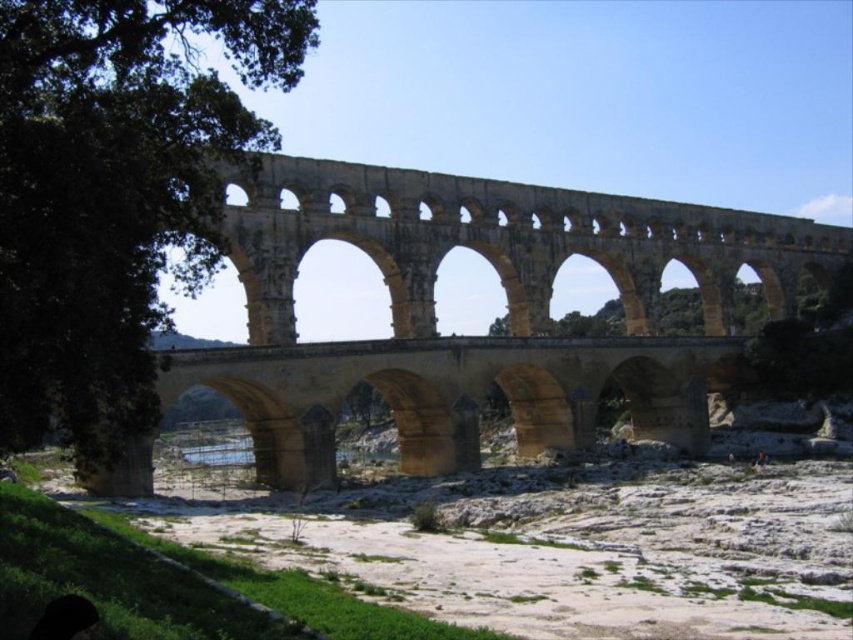
Question: Does yellow stone bridge at center appear on the right side of green leafy tree at left?

Choices:
 (A) no
 (B) yes

Answer: (B)

Question: Which object appears farthest from the camera in this image?

Choices:
 (A) green leafy tree at left
 (B) yellow stone bridge at center

Answer: (B)

Question: Can you confirm if yellow stone bridge at center is positioned above green leafy tree at left?

Choices:
 (A) yes
 (B) no

Answer: (B)

Question: Considering the relative positions of yellow stone bridge at center and green leafy tree at left in the image provided, where is yellow stone bridge at center located with respect to green leafy tree at left?

Choices:
 (A) below
 (B) above

Answer: (A)